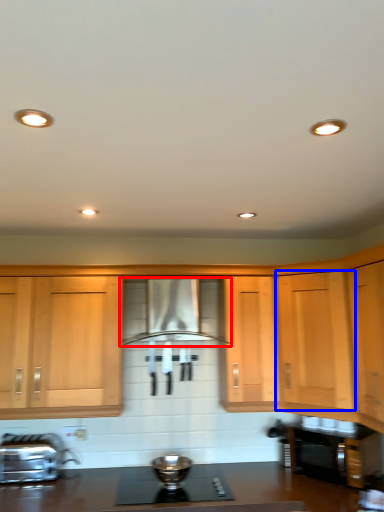
Question: Which object is closer to the camera taking this photo, home appliance (highlighted by a red box) or cabinetry (highlighted by a blue box)?

Choices:
 (A) home appliance
 (B) cabinetry

Answer: (B)